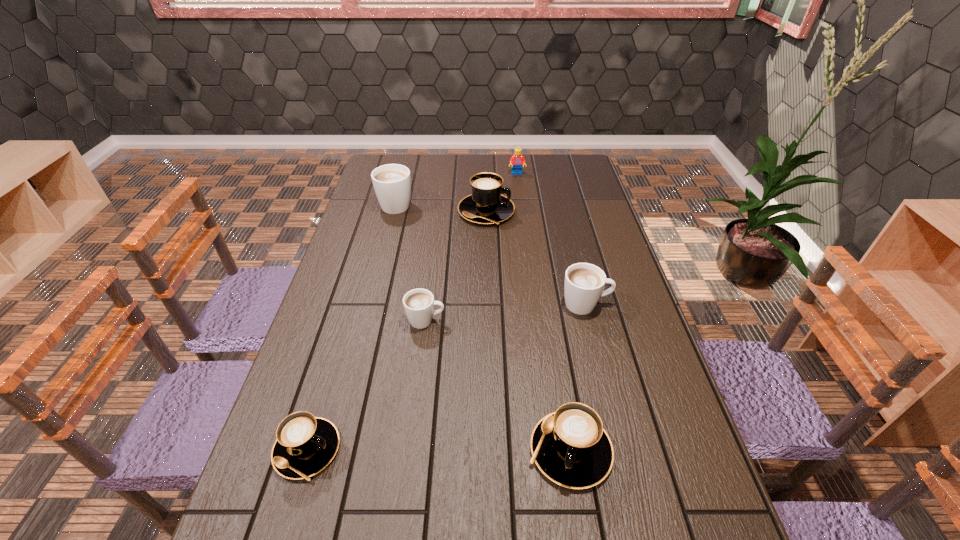
Image resolution: width=960 pixels, height=540 pixels. Identify the location of free space between the smallest black cappuccino and the second smallest black cappuccino. (439, 450).

Where is `object that is the fifth closest to the third cappuccino from left to right`? object that is the fifth closest to the third cappuccino from left to right is located at coordinates click(x=392, y=182).

Locate an element on the screen. Image resolution: width=960 pixels, height=540 pixels. object that stands as the second closest to the biggest white cappuccino is located at coordinates (517, 160).

Identify which cappuccino is the fourth nearest to the farthest object. Please provide its 2D coordinates. Your answer should be formatted as a tuple, i.e. [(x, y)], where the tuple contains the x and y coordinates of a point satisfying the conditions above.

[(418, 304)]

Find the location of a particular element. The image size is (960, 540). cappuccino that is the fifth closest one to the biggest white cappuccino is located at coordinates (570, 446).

Find the location of `white cappuccino that is the closest to the farthest white cappuccino`. white cappuccino that is the closest to the farthest white cappuccino is located at coordinates (418, 304).

The image size is (960, 540). I want to click on white cappuccino that is the closest one to the third object from left to right, so click(x=584, y=283).

This screenshot has height=540, width=960. I want to click on black cappuccino that is the second closest to the rightmost white cappuccino, so click(x=486, y=205).

Choose which black cappuccino is the second nearest neighbor to the farthest object. Please provide its 2D coordinates. Your answer should be formatted as a tuple, i.e. [(x, y)], where the tuple contains the x and y coordinates of a point satisfying the conditions above.

[(570, 446)]